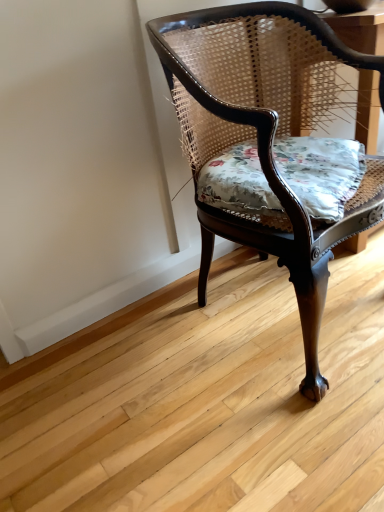
Question: Should I look upward or downward to see floral fabric cushion at center?

Choices:
 (A) down
 (B) up

Answer: (B)

Question: Is mahogany cane chair at center bigger than floral fabric cushion at center?

Choices:
 (A) no
 (B) yes

Answer: (B)

Question: Is mahogany cane chair at center thinner than floral fabric cushion at center?

Choices:
 (A) yes
 (B) no

Answer: (B)

Question: Would you say floral fabric cushion at center is part of mahogany cane chair at center's contents?

Choices:
 (A) no
 (B) yes

Answer: (B)

Question: Is mahogany cane chair at center further to the viewer compared to floral fabric cushion at center?

Choices:
 (A) yes
 (B) no

Answer: (B)

Question: Is mahogany cane chair at center not close to floral fabric cushion at center?

Choices:
 (A) yes
 (B) no

Answer: (B)

Question: Is mahogany cane chair at center wider than floral fabric cushion at center?

Choices:
 (A) yes
 (B) no

Answer: (A)

Question: Considering the relative sizes of floral fabric cushion at center and mahogany cane chair at center in the image provided, is floral fabric cushion at center smaller than mahogany cane chair at center?

Choices:
 (A) no
 (B) yes

Answer: (B)

Question: Does floral fabric cushion at center contain mahogany cane chair at center?

Choices:
 (A) no
 (B) yes

Answer: (A)

Question: Does floral fabric cushion at center have a greater height compared to mahogany cane chair at center?

Choices:
 (A) no
 (B) yes

Answer: (A)

Question: Does floral fabric cushion at center come in front of mahogany cane chair at center?

Choices:
 (A) yes
 (B) no

Answer: (B)

Question: Is floral fabric cushion at center wider than mahogany cane chair at center?

Choices:
 (A) no
 (B) yes

Answer: (A)

Question: From the image's perspective, is floral fabric cushion at center on mahogany cane chair at center?

Choices:
 (A) no
 (B) yes

Answer: (B)

Question: Considering their positions, is floral fabric cushion at center located in front of or behind mahogany cane chair at center?

Choices:
 (A) front
 (B) behind

Answer: (B)